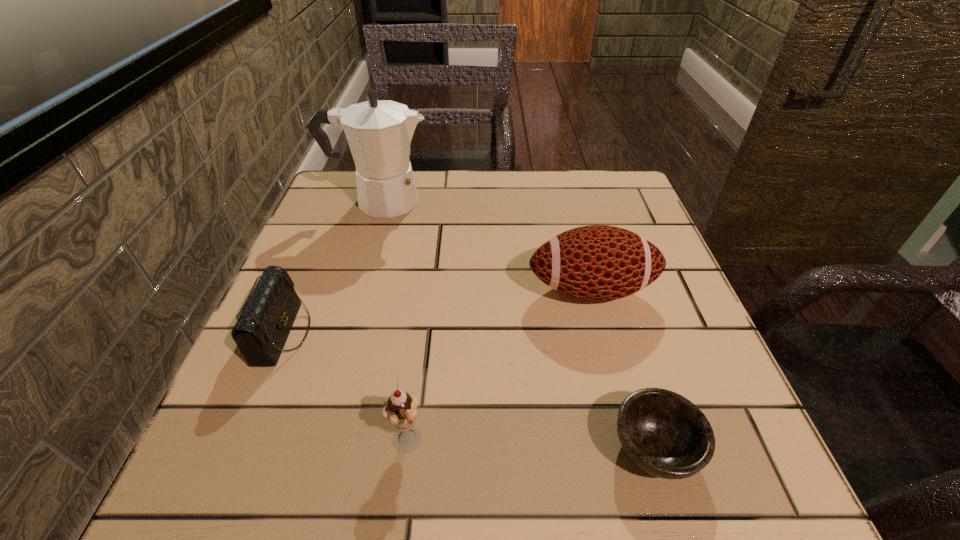
The height and width of the screenshot is (540, 960). In order to click on free spot between the farthest object and the second shortest object in this screenshot , I will do `click(331, 267)`.

Find the location of a particular element. Image resolution: width=960 pixels, height=540 pixels. free space between the football and the icecream is located at coordinates (499, 366).

At what (x,y) coordinates should I click in order to perform the action: click on vacant region between the icecream and the bowl. Please return your answer as a coordinate pair (x, y). Looking at the image, I should click on (531, 445).

Find the location of a particular element. The height and width of the screenshot is (540, 960). vacant area that lies between the fourth tallest object and the coffeepot is located at coordinates (331, 267).

The height and width of the screenshot is (540, 960). I want to click on vacant space that's between the football and the clutch bag, so click(x=437, y=312).

You are a GUI agent. You are given a task and a screenshot of the screen. Output one action in this format:
    pyautogui.click(x=<x>, y=<y>)
    Task: Click on the vacant region between the icecream and the farthest object
    The height and width of the screenshot is (540, 960).
    Given the screenshot: What is the action you would take?
    pyautogui.click(x=393, y=322)

Where is `vacant space that is in between the icecream and the coffeepot`? vacant space that is in between the icecream and the coffeepot is located at coordinates (393, 322).

Find the location of `unoccupied position between the football and the second shortest object`. unoccupied position between the football and the second shortest object is located at coordinates (437, 312).

The height and width of the screenshot is (540, 960). What are the coordinates of `object that is the fourth closest to the bowl` in the screenshot? It's located at (379, 132).

Locate an element on the screen. This screenshot has width=960, height=540. object that is the second closest to the second shortest object is located at coordinates click(x=379, y=132).